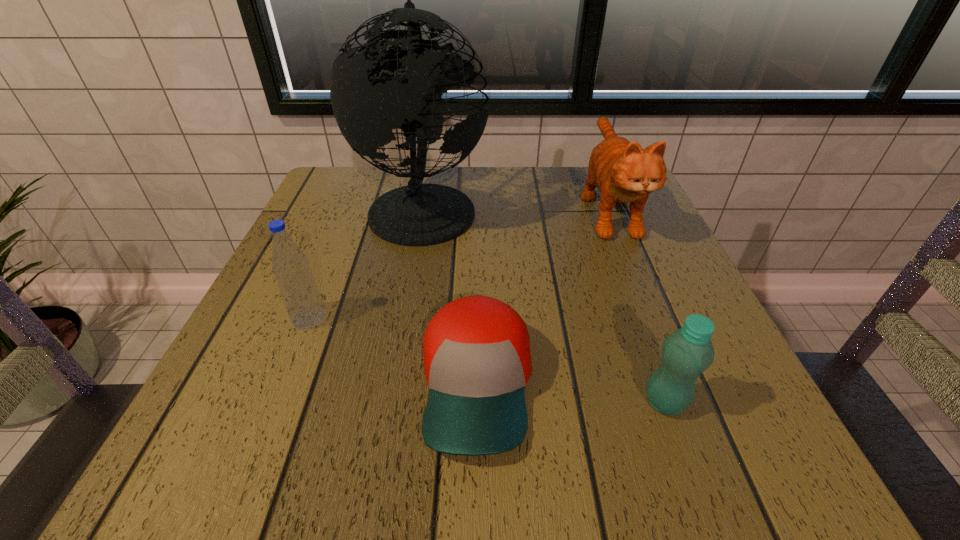
In order to click on vacant space that's between the farther water bottle and the baseball cap in this screenshot , I will do `click(393, 351)`.

The image size is (960, 540). Identify the location of empty space between the tallest object and the cat. (516, 207).

Identify the location of free space between the globe and the cat. (516, 207).

You are a GUI agent. You are given a task and a screenshot of the screen. Output one action in this format:
    pyautogui.click(x=<x>, y=<y>)
    Task: Click on the unoccupied position between the globe and the baseball cap
    
    Given the screenshot: What is the action you would take?
    pyautogui.click(x=450, y=296)

Where is `free space between the shortest object and the shorter water bottle`? This screenshot has width=960, height=540. free space between the shortest object and the shorter water bottle is located at coordinates (571, 393).

Find the location of a particular element. Image resolution: width=960 pixels, height=540 pixels. vacant point located between the baseball cap and the tallest object is located at coordinates (450, 296).

This screenshot has width=960, height=540. Find the location of `empty space between the shortest object and the farther water bottle`. empty space between the shortest object and the farther water bottle is located at coordinates (393, 351).

Identify the location of empty space between the tallest object and the baseball cap. (450, 296).

The image size is (960, 540). In order to click on empty location between the baseball cap and the tallest object in this screenshot , I will do `click(450, 296)`.

Point out which object is positioned as the third nearest to the farther water bottle. Please provide its 2D coordinates. Your answer should be formatted as a tuple, i.e. [(x, y)], where the tuple contains the x and y coordinates of a point satisfying the conditions above.

[(685, 354)]